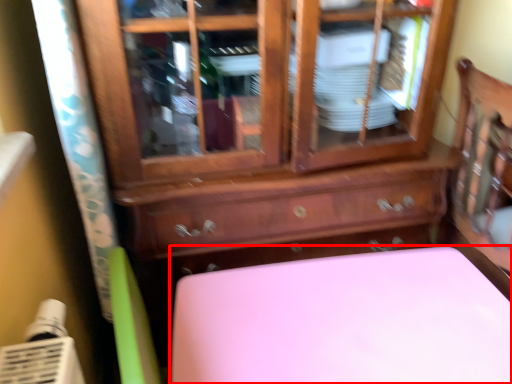
Question: From the image's perspective, where is furniture (annotated by the red box) located in relation to chest of drawers in the image?

Choices:
 (A) above
 (B) below

Answer: (B)